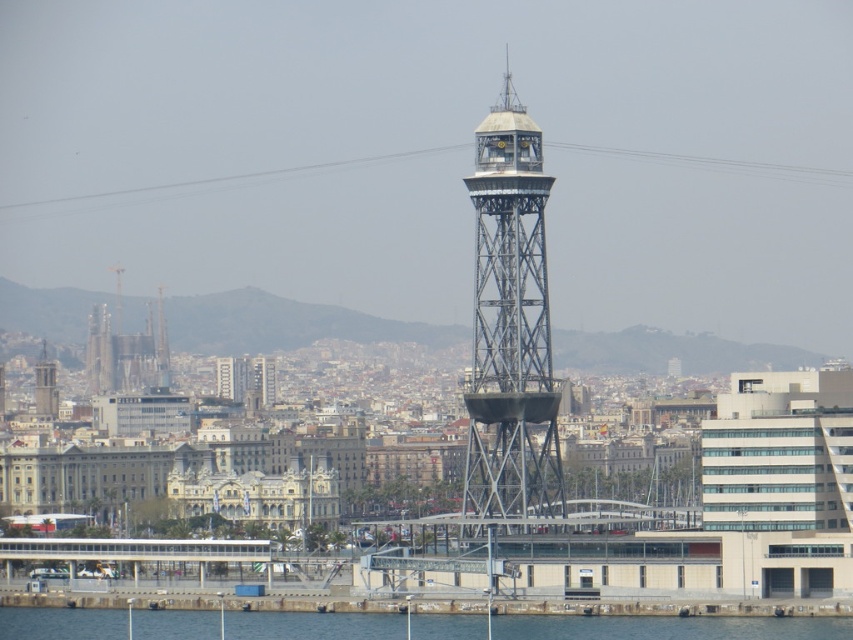
You are a photographer planning to capture the cityscape with both the clear blue water at lower center and the matte gray tower at center in the frame. Which object should you focus on if you want to emphasize the larger subject in your photo?

You should focus on the clear blue water at lower center because it is larger in size than the matte gray tower at center according to the description.